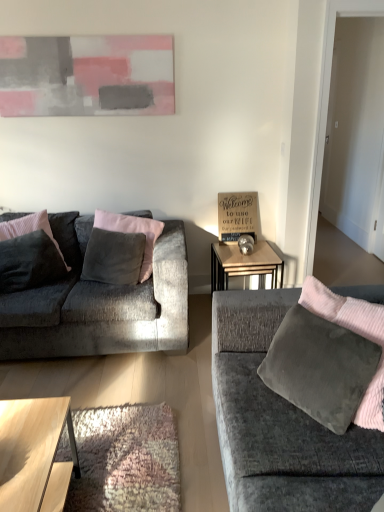
The image size is (384, 512). Find the location of `vacant space situated above abstract painting at upper center (from a real-world perspective)`. vacant space situated above abstract painting at upper center (from a real-world perspective) is located at coordinates (79, 31).